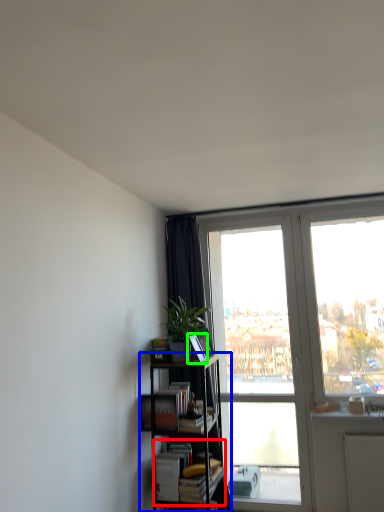
Question: Estimate the real-world distances between objects in this image. Which object is closer to book (highlighted by a red box), bookcase (highlighted by a blue box) or paperback book (highlighted by a green box)?

Choices:
 (A) bookcase
 (B) paperback book

Answer: (A)